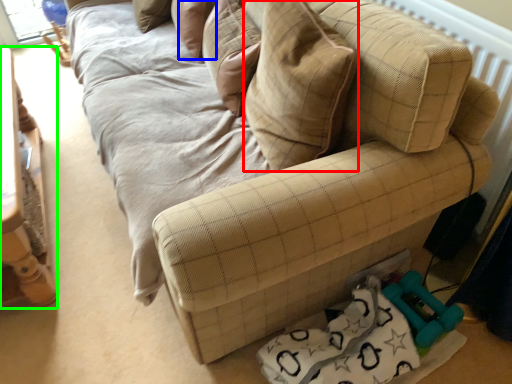
Question: Which object is positioned closest to throw pillow (highlighted by a red box)? Select from pillow (highlighted by a blue box) and furniture (highlighted by a green box).

Choices:
 (A) pillow
 (B) furniture

Answer: (A)